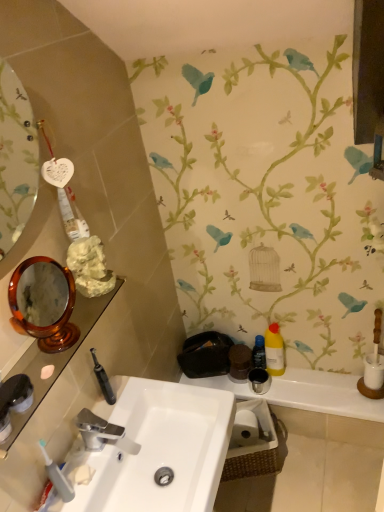
Where is `vacant space in front of black plastic bottle at right, the 1th mouthwash in the left-to-right sequence`? The width and height of the screenshot is (384, 512). vacant space in front of black plastic bottle at right, the 1th mouthwash in the left-to-right sequence is located at coordinates (289, 389).